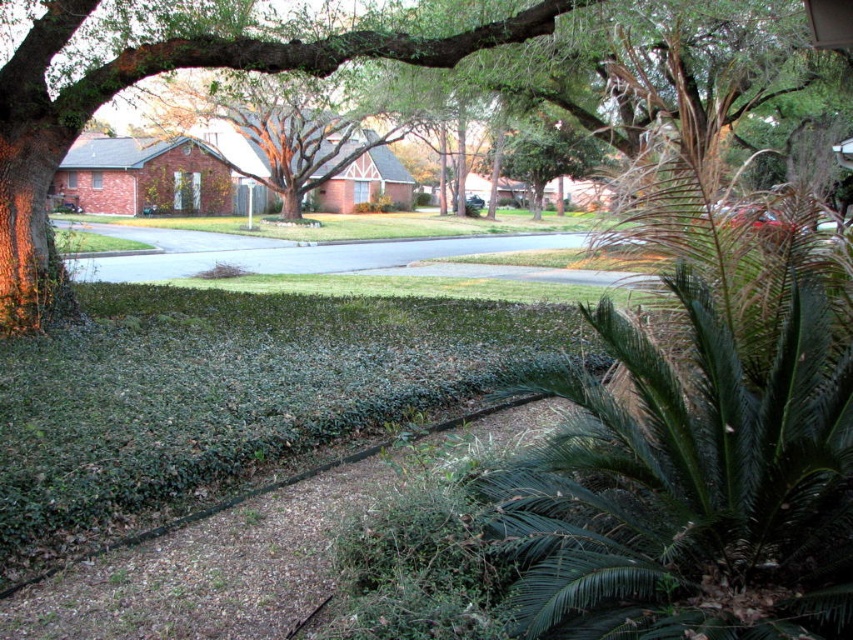
You are standing at the entrance of the suburban neighborhood and want to walk towards the green leafy palm at lower right and the green leafy tree at center. Which one will you see first as you approach the scene?

The green leafy palm at lower right will be seen first because it is positioned below the green leafy tree at center, making it closer to the viewer.

You are a gardener planning to plant a new flower bed between the green leafy palm at lower right and the green leafy tree at center. Based on their widths, which tree should you consider for spacing adjustments to accommodate the flower bed?

The green leafy palm at lower right might be wider than the green leafy tree at center, so you should consider adjusting the spacing around the wider palm to make room for the flower bed.